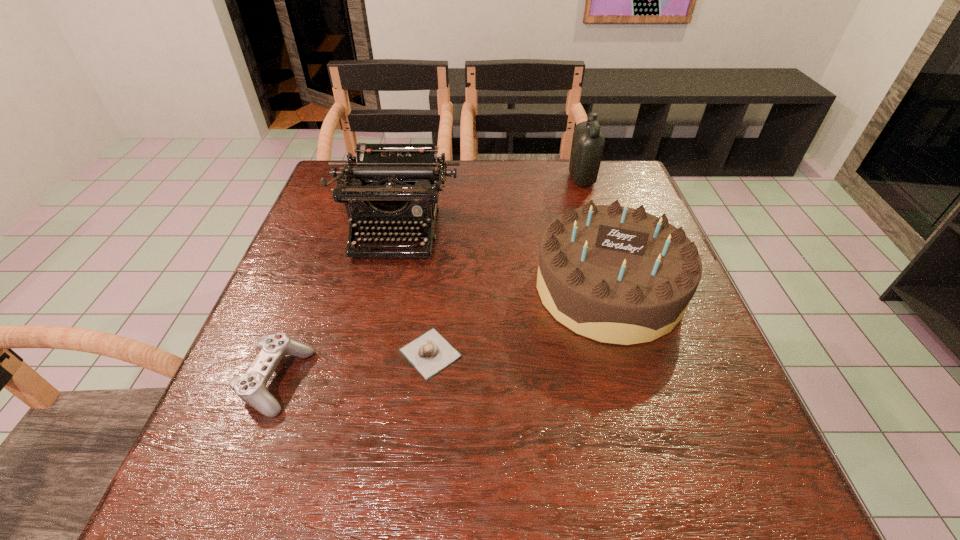
You are a GUI agent. You are given a task and a screenshot of the screen. Output one action in this format:
    pyautogui.click(x=<x>, y=<y>)
    Task: Click on the bottle that is at the far edge
    Image resolution: width=960 pixels, height=540 pixels.
    Given the screenshot: What is the action you would take?
    pyautogui.click(x=588, y=142)

Locate an element on the screen. Image resolution: width=960 pixels, height=540 pixels. typewriter situated at the far edge is located at coordinates (390, 184).

The image size is (960, 540). In order to click on typewriter that is at the left edge in this screenshot , I will do 390,184.

This screenshot has height=540, width=960. What are the coordinates of `control positioned at the left edge` in the screenshot? It's located at (251, 387).

The width and height of the screenshot is (960, 540). I want to click on bottle that is at the right edge, so click(588, 142).

Locate an element on the screen. birthday cake that is at the right edge is located at coordinates [614, 274].

I want to click on object located at the far left corner, so click(x=390, y=184).

Identify the location of object that is positioned at the far right corner. Image resolution: width=960 pixels, height=540 pixels. (588, 142).

This screenshot has width=960, height=540. Identify the location of vacant region at the far edge of the desktop. (456, 200).

Identify the location of blank space at the near edge of the desktop. click(x=334, y=468).